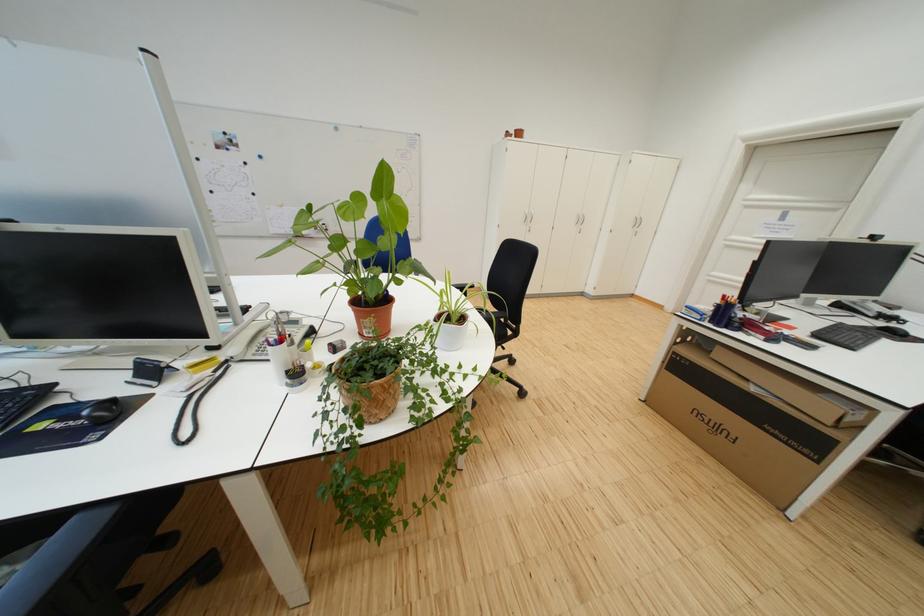
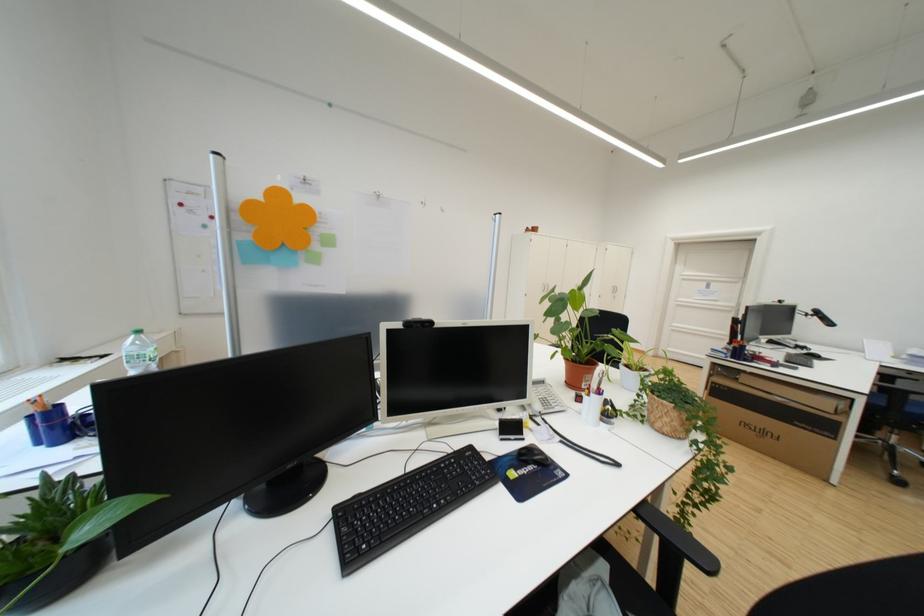
Find the pixel in the second image that matches point (795, 220) in the first image.

(720, 288)